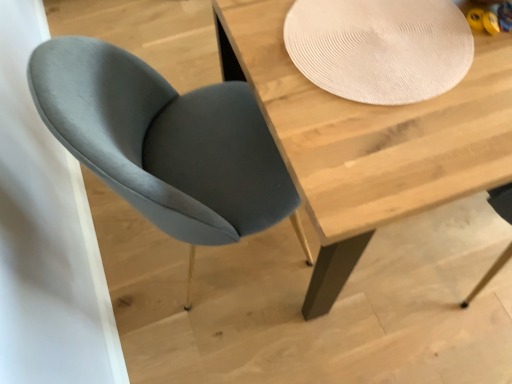
Question: Should I look upward or downward to see beige textured placemat at upper center?

Choices:
 (A) up
 (B) down

Answer: (A)

Question: Would you say beige textured placemat at upper center is outside velvet grey chair at left?

Choices:
 (A) no
 (B) yes

Answer: (B)

Question: Considering the relative sizes of beige textured placemat at upper center and velvet grey chair at left in the image provided, is beige textured placemat at upper center thinner than velvet grey chair at left?

Choices:
 (A) no
 (B) yes

Answer: (B)

Question: Is beige textured placemat at upper center to the right of velvet grey chair at left from the viewer's perspective?

Choices:
 (A) yes
 (B) no

Answer: (A)

Question: From a real-world perspective, is beige textured placemat at upper center on velvet grey chair at left?

Choices:
 (A) yes
 (B) no

Answer: (A)

Question: Can you confirm if beige textured placemat at upper center is bigger than velvet grey chair at left?

Choices:
 (A) yes
 (B) no

Answer: (B)

Question: Considering the relative positions of beige textured placemat at upper center and velvet grey chair at left in the image provided, is beige textured placemat at upper center behind velvet grey chair at left?

Choices:
 (A) yes
 (B) no

Answer: (A)

Question: Is wooden table at center oriented towards beige textured placemat at upper center?

Choices:
 (A) no
 (B) yes

Answer: (A)

Question: Is wooden table at center to the left of beige textured placemat at upper center from the viewer's perspective?

Choices:
 (A) yes
 (B) no

Answer: (B)

Question: From the image's perspective, would you say wooden table at center is positioned over beige textured placemat at upper center?

Choices:
 (A) no
 (B) yes

Answer: (A)

Question: Is beige textured placemat at upper center at the back of wooden table at center?

Choices:
 (A) no
 (B) yes

Answer: (A)

Question: Would you say wooden table at center is a long distance from beige textured placemat at upper center?

Choices:
 (A) yes
 (B) no

Answer: (B)

Question: Is wooden table at center outside of beige textured placemat at upper center?

Choices:
 (A) no
 (B) yes

Answer: (B)

Question: From the image's perspective, does velvet grey chair at left appear higher than wooden table at center?

Choices:
 (A) no
 (B) yes

Answer: (A)